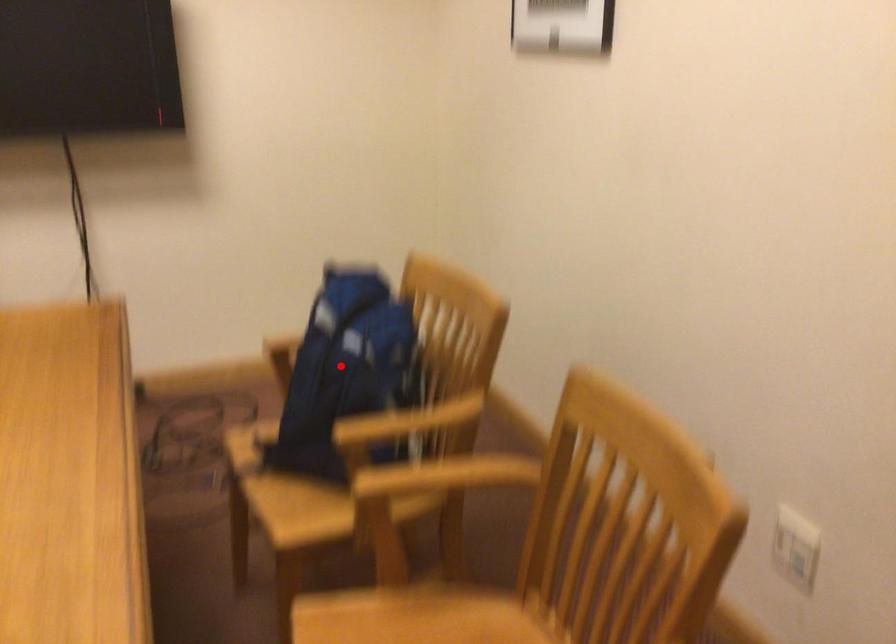
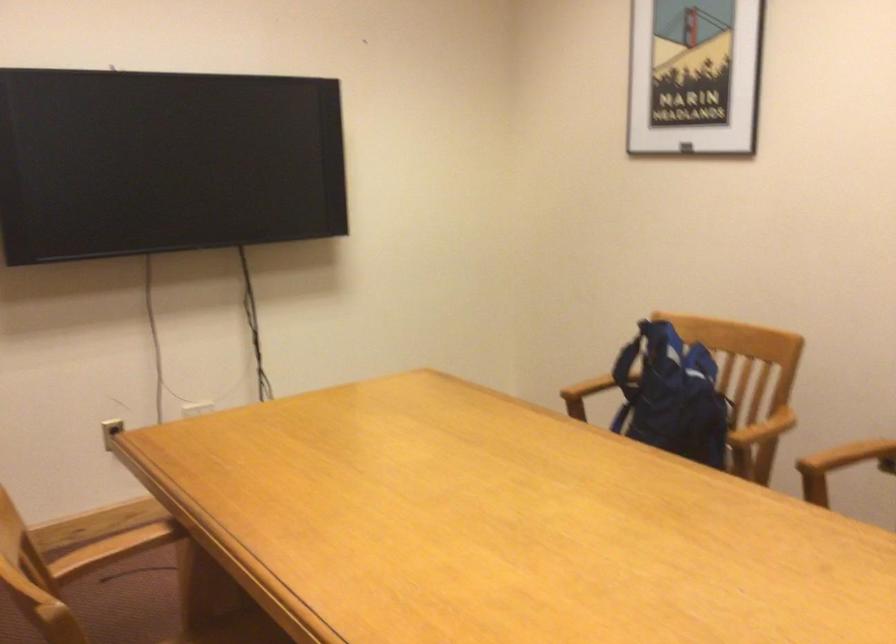
Question: I am providing you with two images of the same scene from different viewpoints. Image1 has a red point marked. In image2, the corresponding 3D location appears at what relative position? Reply with the corresponding letter.

Choices:
 (A) Closer
 (B) Farther

Answer: (B)